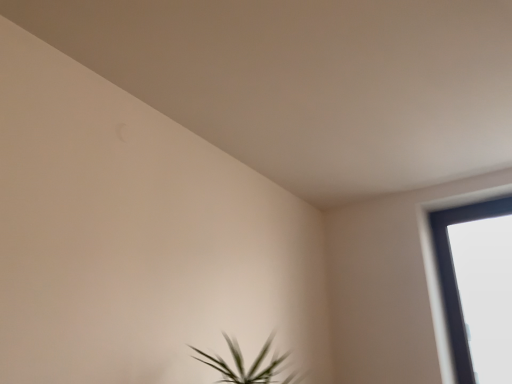
In order to face transparent glass window at upper right, should I rotate leftwards or rightwards?

To face it directly, rotate right by 28.379 degrees.

Identify the location of transparent glass window at upper right. (436, 267).

What is the approximate height of transparent glass window at upper right?

The height of transparent glass window at upper right is 1.04 meters.

Measure the distance between transparent glass window at upper right and camera.

The distance of transparent glass window at upper right from camera is 7.34 feet.

What do you see at coordinates (436, 267) in the screenshot? I see `transparent glass window at upper right` at bounding box center [436, 267].

At what (x,y) coordinates should I click in order to perform the action: click on transparent glass window at upper right. Please return your answer as a coordinate pair (x, y). The image size is (512, 384). Looking at the image, I should click on (436, 267).